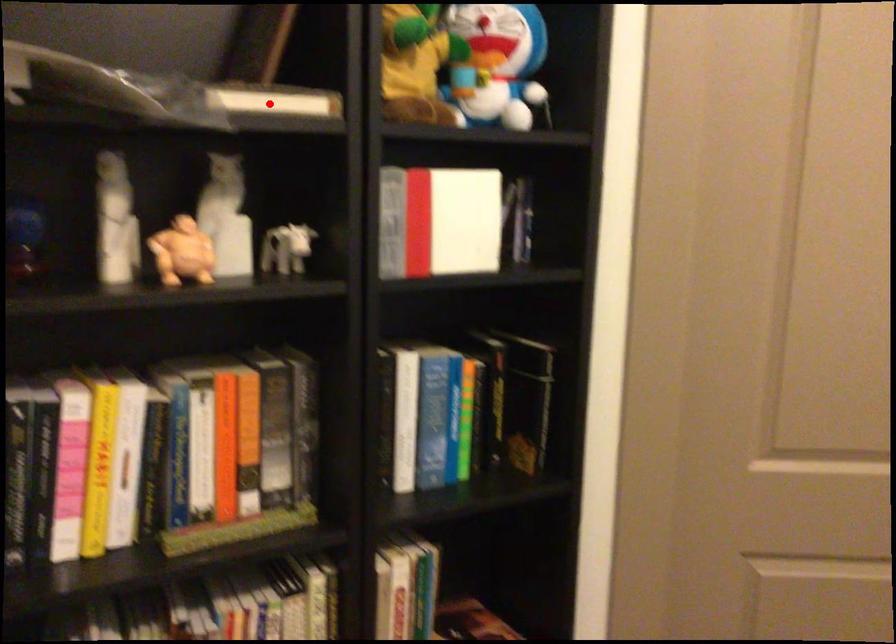
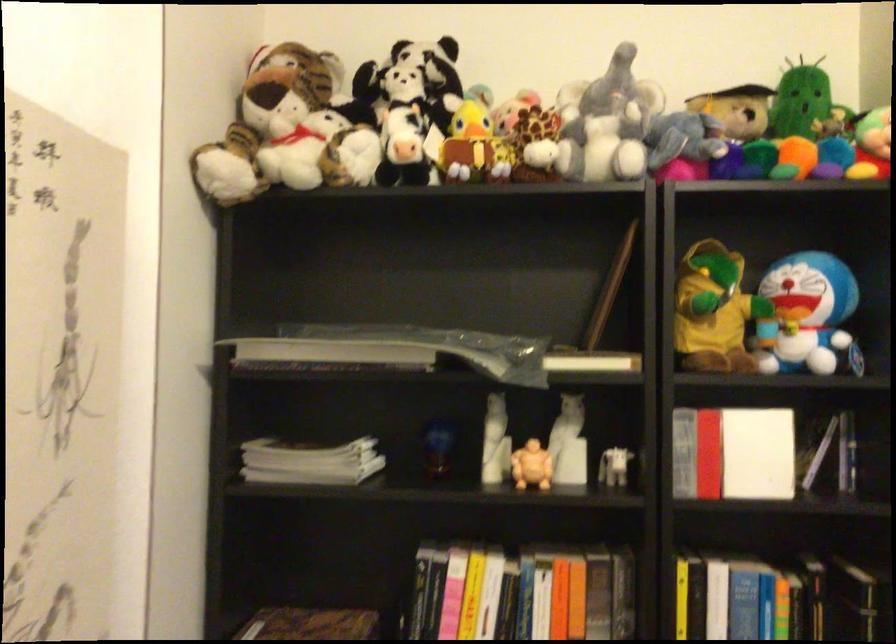
Question: I am providing you with two images of the same scene from different viewpoints. Image1 has a red point marked. In image2, the corresponding 3D location appears at what relative position? Reply with the corresponding letter.

Choices:
 (A) Closer
 (B) Farther

Answer: (B)